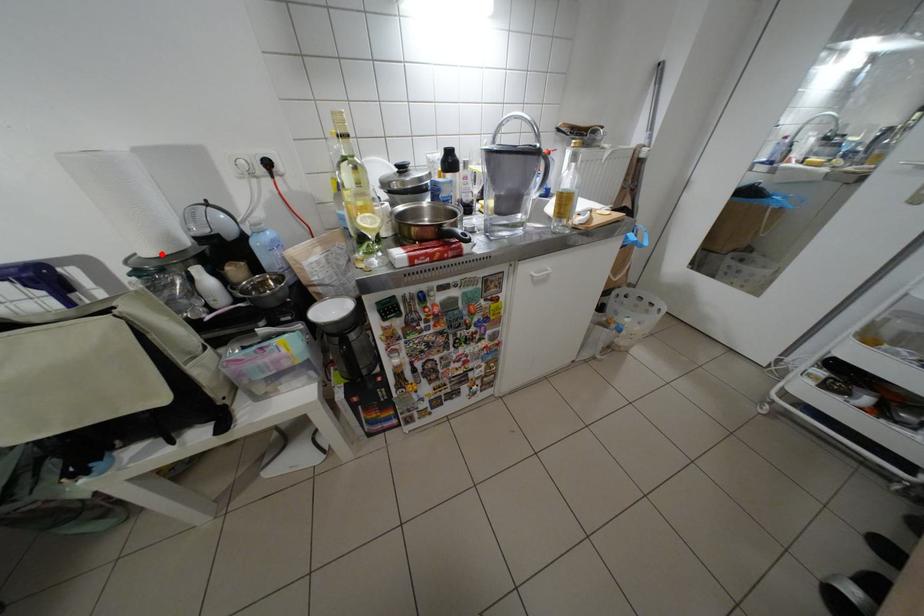
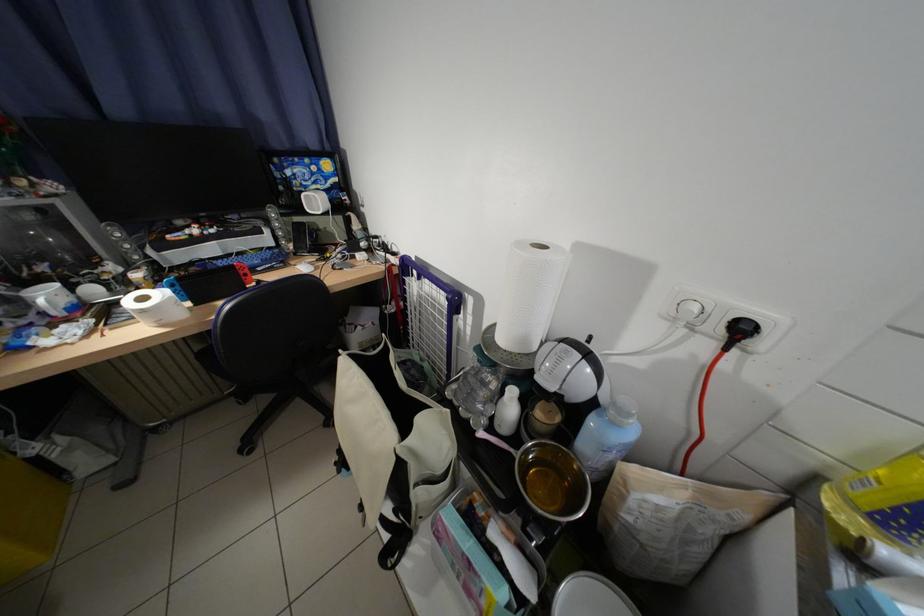
In the second image, find the point that corresponds to the highlighted location in the first image.

(514, 341)